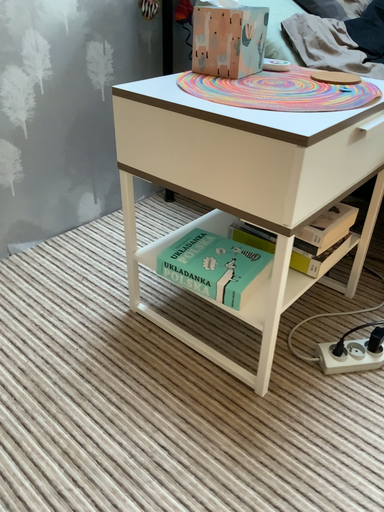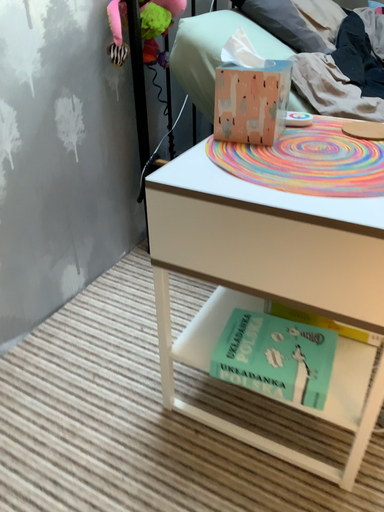
Question: Which way did the camera rotate in the video?

Choices:
 (A) rotated left
 (B) rotated right

Answer: (B)